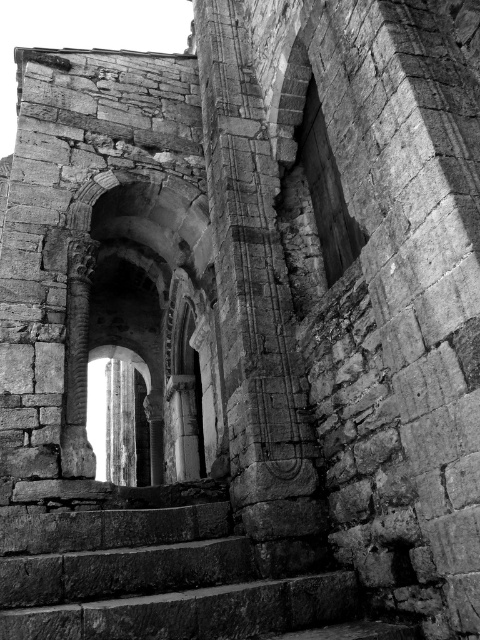
Question: Can you confirm if stone archway at center is thinner than rough stone stairs at center?

Choices:
 (A) no
 (B) yes

Answer: (A)

Question: From the image, what is the correct spatial relationship of stone archway at center in relation to rough stone stairs at center?

Choices:
 (A) above
 (B) below

Answer: (A)

Question: Can you confirm if stone archway at center is positioned below rough stone stairs at center?

Choices:
 (A) yes
 (B) no

Answer: (B)

Question: Among these points, which one is farthest from the camera?

Choices:
 (A) (96, 348)
 (B) (103, 557)

Answer: (A)